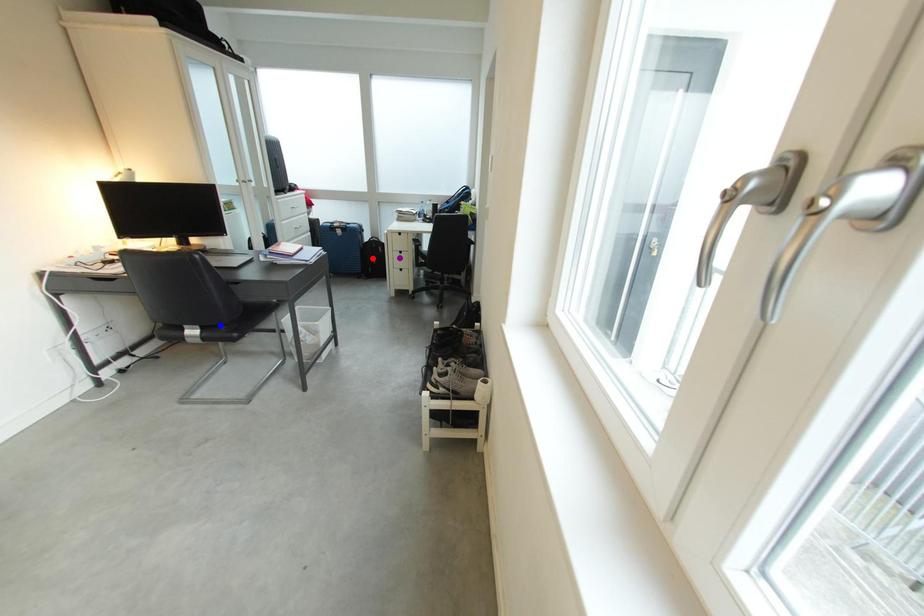
Order these from farthest to nearest:
blue point
red point
purple point

red point → purple point → blue point